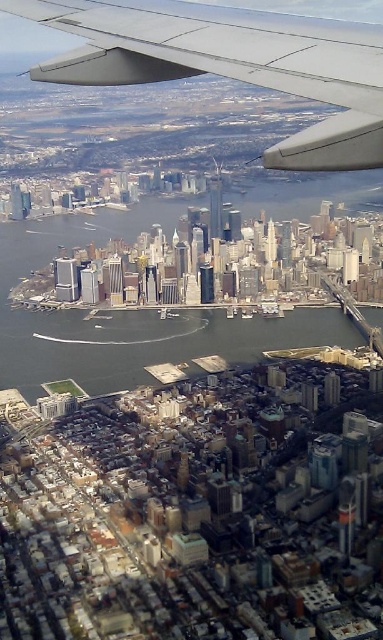
You are a pilot flying an airplane and notice the green water at center and the matte gray wing at upper center in your view. Which object is positioned lower in your field of view?

The green water at center is positioned lower than the matte gray wing at upper center in the field of view.

Based on the photo, you are a pilot flying an airplane and notice the green water at center and the matte gray wing at upper center from your window. How far apart are these two landmarks from each other?

The green water at center is 150.64 meters away from the matte gray wing at upper center.

You are a drone operator trying to capture a photo of the point at coordinates (358, 188) in the image. The drone has a maximum flight range of 600 meters. Will the drone be able to reach the point?

The distance of point (358, 188) from the camera is 664.53 meters, which exceeds the drone operator maximum flight range of 600 meters. Therefore, the drone cannot reach the point.